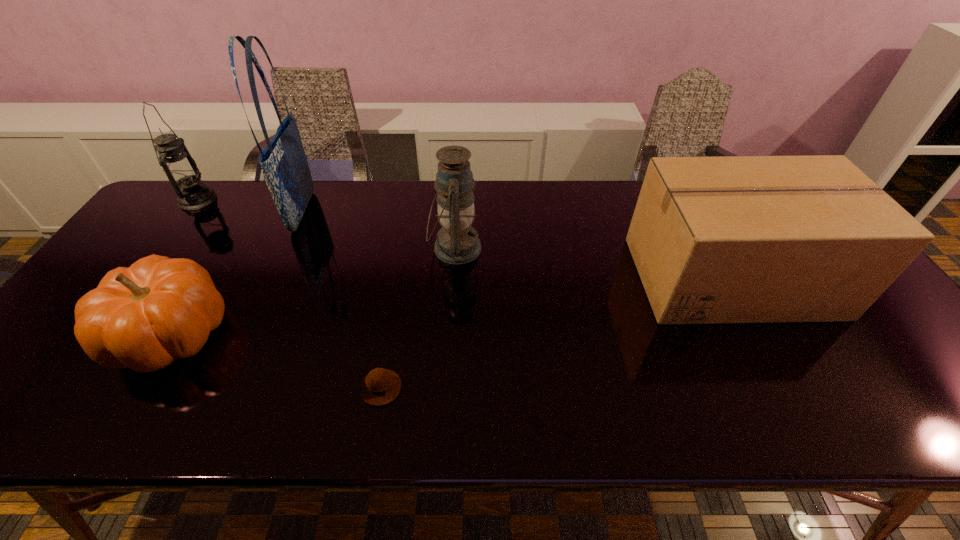
Locate an element on the screen. shopping bag is located at coordinates (285, 168).

Locate an element on the screen. the third object from left to right is located at coordinates (285, 168).

You are a GUI agent. You are given a task and a screenshot of the screen. Output one action in this format:
    pyautogui.click(x=<x>, y=<y>)
    Task: Click on the farther oil lamp
    Image resolution: width=960 pixels, height=540 pixels.
    Given the screenshot: What is the action you would take?
    pyautogui.click(x=181, y=170)

Where is `the second object from right to left`? The height and width of the screenshot is (540, 960). the second object from right to left is located at coordinates (457, 242).

Image resolution: width=960 pixels, height=540 pixels. I want to click on the right oil lamp, so click(457, 242).

What are the coordinates of `the rightmost object` in the screenshot? It's located at (737, 239).

Where is `the second shortest object`? This screenshot has height=540, width=960. the second shortest object is located at coordinates (159, 309).

Identify the location of the fourth object from left to right. (381, 386).

What are the coordinates of `muffin` in the screenshot? It's located at (381, 386).

Find the location of a particular element. The width and height of the screenshot is (960, 540). blank area located on the front-facing side of the fourth object from right to left is located at coordinates click(x=404, y=212).